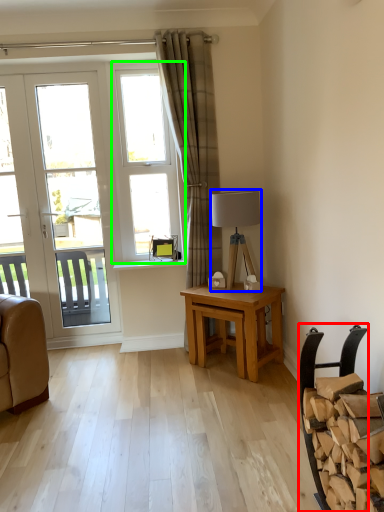
Question: Which is nearer to the chair (highlighted by a red box)? lamp (highlighted by a blue box) or window (highlighted by a green box).

Choices:
 (A) lamp
 (B) window

Answer: (A)